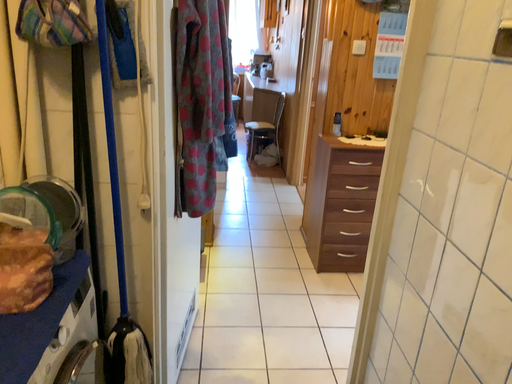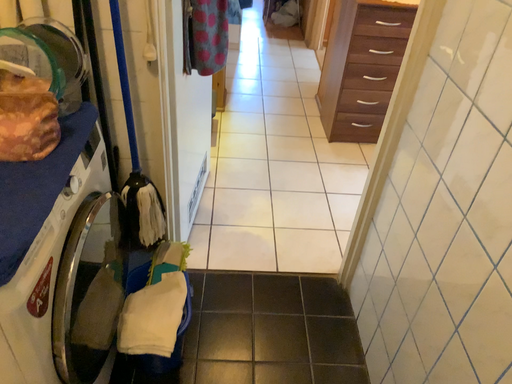
Question: Which way did the camera rotate in the video?

Choices:
 (A) rotated downward
 (B) rotated upward

Answer: (A)